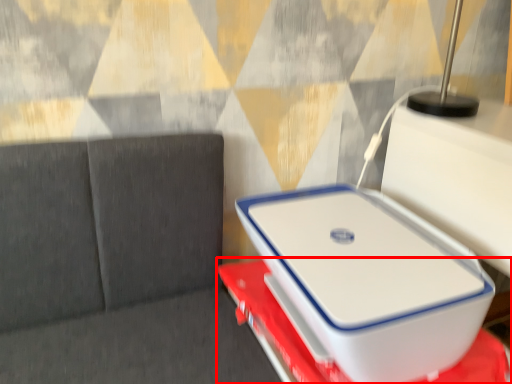
Question: In this image, where is furniture (annotated by the red box) located relative to laptop?

Choices:
 (A) left
 (B) right

Answer: (B)